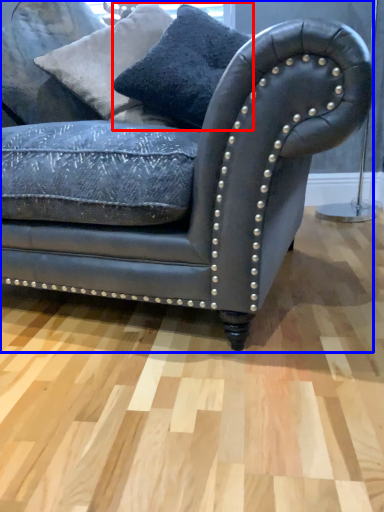
Question: Which object appears farthest to the camera in this image, pillow (highlighted by a red box) or studio couch (highlighted by a blue box)?

Choices:
 (A) pillow
 (B) studio couch

Answer: (A)